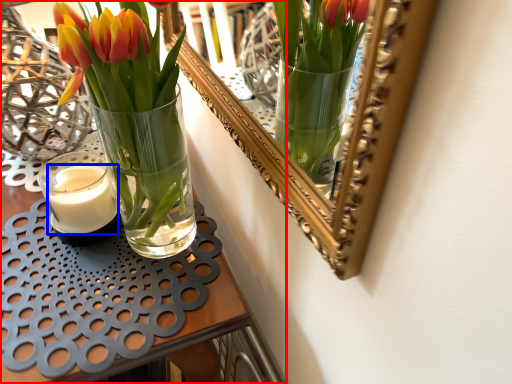
Question: Which object appears closest to the camera in this image, table (highlighted by a red box) or candle (highlighted by a blue box)?

Choices:
 (A) table
 (B) candle

Answer: (A)